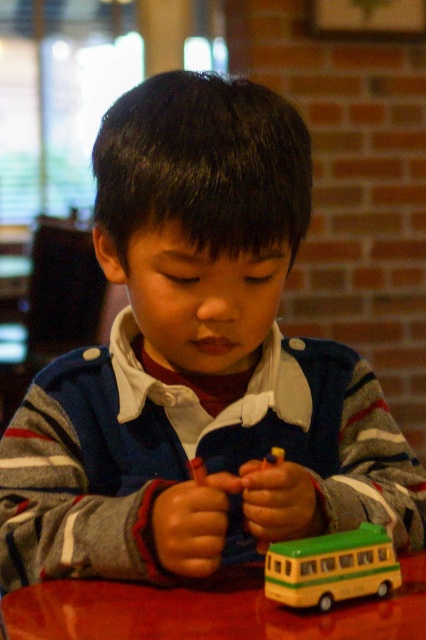
You are a parent observing your child playing with the yellow matte bus at lower center while sitting at the shiny red table at lower center. Can you determine if the bus will fit on the table?

The shiny red table at lower center has a lesser height compared to yellow matte bus at lower center, so the bus might not fit on the table due to the table being shorter than the bus.

You are a parent trying to place a small snack plate on the shiny red table at lower center while your child is holding the yellow matte bus at lower center. Will the snack plate fit on the table without overlapping the bus?

The shiny red table at lower center is larger in size than the yellow matte bus at lower center, so there should be enough space to place the snack plate on the table without overlapping the bus.

You are a parent trying to place a small toy airplane on the table. The toy airplane is the same size as the yellow matte bus at lower center. Can you place the toy airplane on the shiny red table at lower center without it hanging off the edge?

The shiny red table at lower center is in front of the yellow matte bus at lower center. Since the toy airplane is the same size as the yellow matte bus at lower center, and the table is positioned in front of it, there should be enough space to place the toy airplane on the shiny red table at lower center without it hanging off the edge.